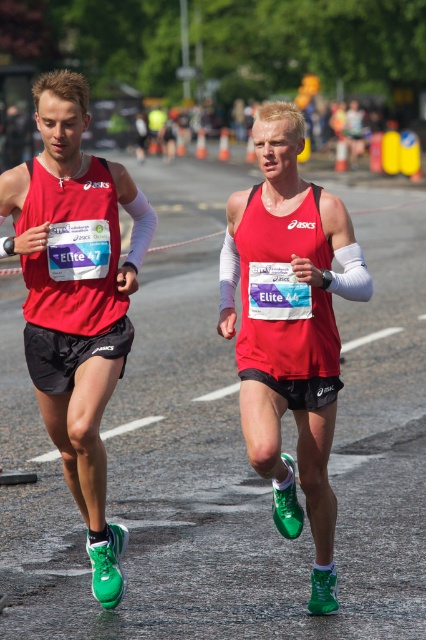
You are a race official standing at the starting line of the marathon. You need to ensure that the two elite runners with bib numbers Elite 47 and Elite 44 are positioned exactly 5 meters apart. Based on their current positions at point [69,116], do you need to adjust their positions to meet the requirement?

The two runners are currently 5.48 meters apart, which is 0.48 meters more than the required 5 meters. Therefore, you should move them closer together by 0.48 meters to meet the requirement.

You are a race official observing the marathon runners. You notice two runners wearing the same brand of clothing. The first runner is wearing a matte red tank top at left, and the second runner is wearing a matte red tank top at center. Based on their positions, which runner is closer to the finish line located ahead?

The matte red tank top at center is behind the matte red tank top at left, so the runner wearing the matte red tank top at left is closer to the finish line.

You are a race official observing the runners. You notice two runners wearing the same brand of clothing. One is wearing a matte red tank top at left and the other a matte red tank top at center. Which runner is positioned lower in the image?

The matte red tank top at left is located below the matte red tank top at center, so the runner wearing the matte red tank top at left is positioned lower in the image.